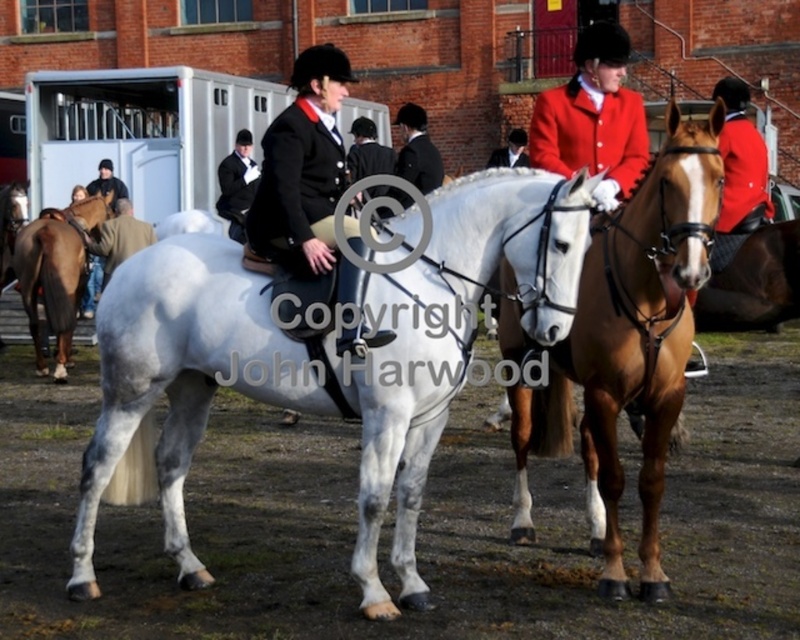
Can you confirm if brown glossy horse at center is wider than brown leather jacket at left?

Indeed, brown glossy horse at center has a greater width compared to brown leather jacket at left.

Which is behind, point (656, 474) or point (136, 236)?

Positioned behind is point (136, 236).

This screenshot has width=800, height=640. Identify the location of brown glossy horse at center. (628, 344).

Between point (662, 280) and point (76, 234), which one is positioned behind?

Point (76, 234)

Is point (648, 280) positioned after point (78, 275)?

No, it is in front of (78, 275).

Which is behind, point (520, 451) or point (66, 321)?

Point (66, 321)

You are a GUI agent. You are given a task and a screenshot of the screen. Output one action in this format:
    pyautogui.click(x=<x>, y=<y>)
    Task: Click on the brown glossy horse at center
    This screenshot has width=800, height=640.
    Given the screenshot: What is the action you would take?
    pyautogui.click(x=628, y=344)

Is white glossy horse at center behind brown glossy horse at center?

Yes, white glossy horse at center is further from the viewer.

What do you see at coordinates (449, 340) in the screenshot?
I see `white glossy horse at center` at bounding box center [449, 340].

This screenshot has width=800, height=640. What do you see at coordinates (449, 340) in the screenshot?
I see `white glossy horse at center` at bounding box center [449, 340].

Find the location of a particular element. white glossy horse at center is located at coordinates (449, 340).